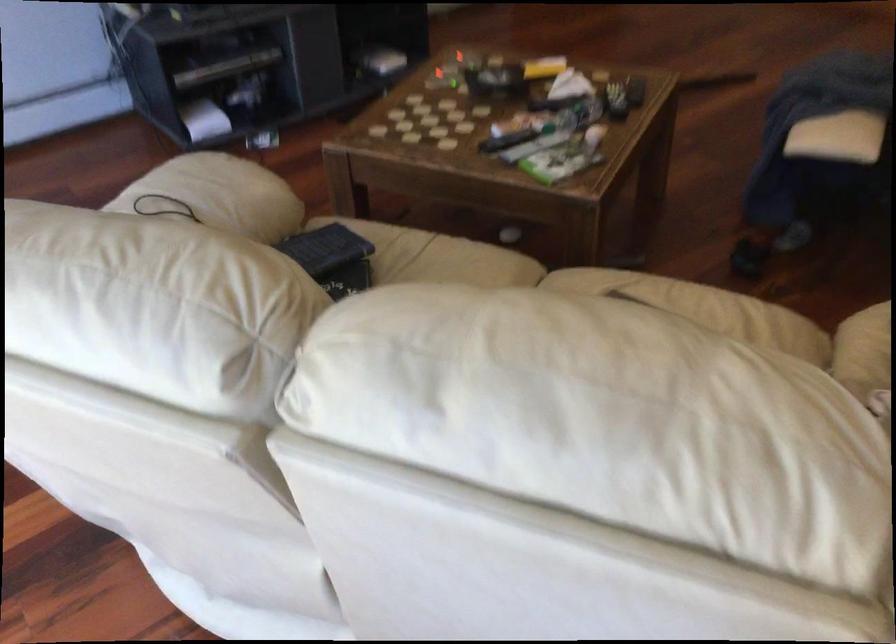
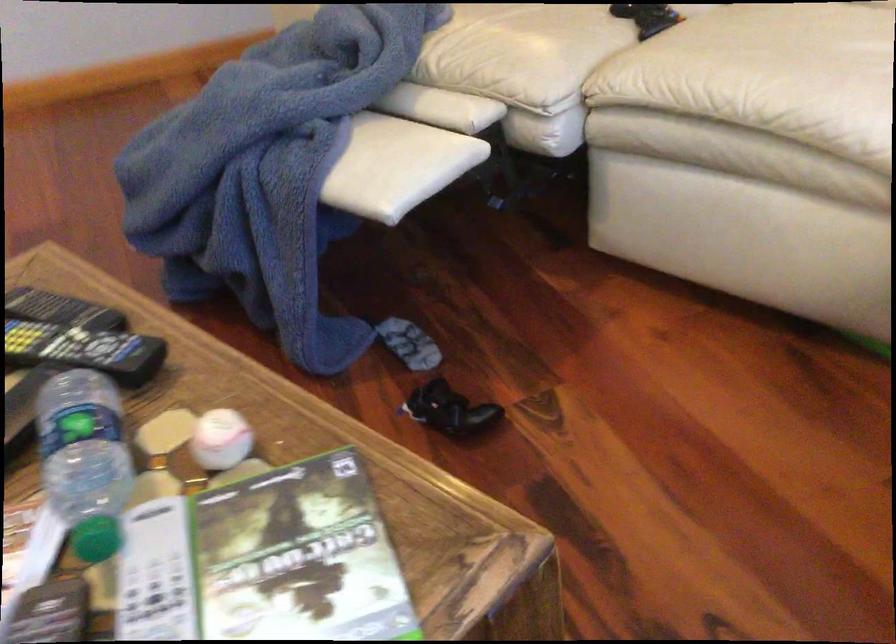
In the second image, find the point that corresponds to (578,126) in the first image.

(220, 439)